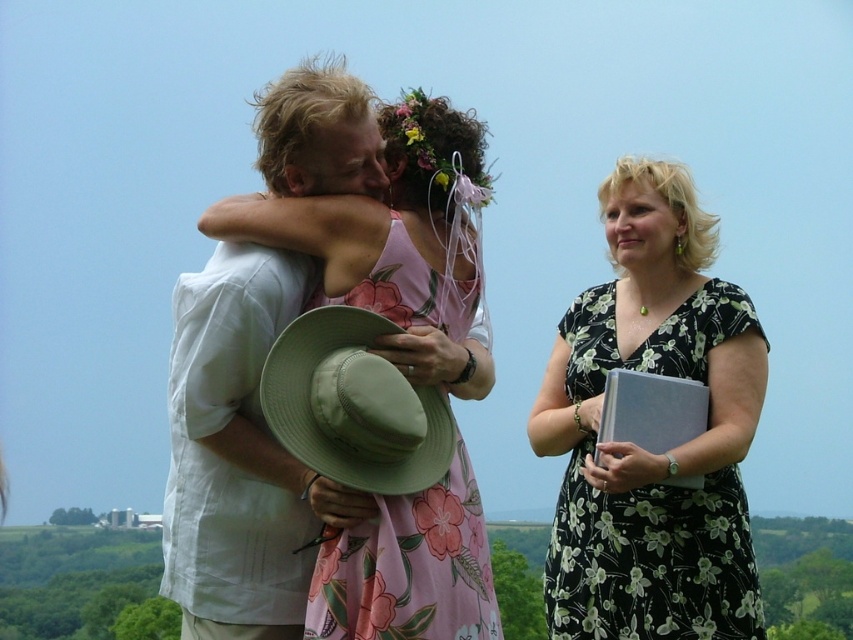
You are a photographer setting up a tripod to capture the scene. You need to ensure that both the light beige cotton shirt at center and the black floral dress at right are fully visible in the frame. Given their heights, which object should you adjust the camera angle to focus on first to ensure both are in the shot?

The light beige cotton shirt at center is taller than the black floral dress at right. To ensure both are fully visible, you should first adjust the camera angle to focus on the light beige cotton shirt at center, as its height may require the camera to be angled lower to capture the entire figure, allowing the shorter black floral dress at right to naturally come into frame.

You are a photographer trying to capture the scene. You want to ensure that both the white linen shirt at center and the black floral dress at right are clearly visible in your photo. Based on their positions, which clothing item is closer to the camera?

The white linen shirt at center is positioned over the black floral dress at right, meaning it is closer to the camera.

You are a photographer at the event and need to position a light to the left of the light beige cotton shirt at center and to the right of the white linen shirt at center. Is this possible based on their current positions?

The light beige cotton shirt at center is to the right of the white linen shirt at center, so placing the light to the left of the light beige cotton shirt at center and to the right of the white linen shirt at center is possible between them.